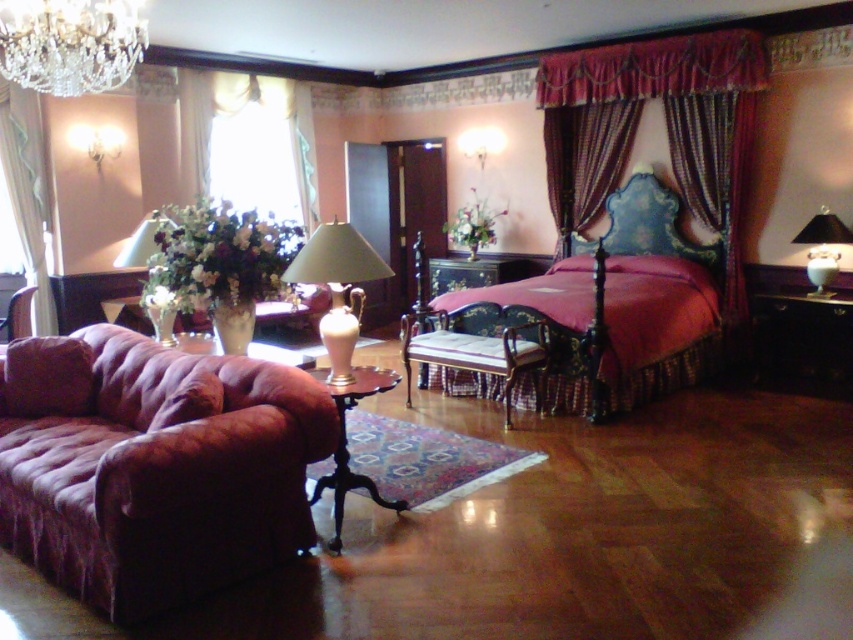
Question: Considering the relative positions of green glass lamp at center and wooden table at center in the image provided, where is green glass lamp at center located with respect to wooden table at center?

Choices:
 (A) above
 (B) below

Answer: (A)

Question: Which is nearer to the green glass lamp at center?

Choices:
 (A) velvet purple couch at lower left
 (B) white sheer curtain at upper left

Answer: (A)

Question: Can you confirm if velvet purple couch at lower left is bigger than velvet burgundy bed at center?

Choices:
 (A) no
 (B) yes

Answer: (A)

Question: Which object appears closest to the camera in this image?

Choices:
 (A) velvet burgundy bed at center
 (B) wooden table at center

Answer: (B)

Question: Is velvet red curtains at upper right behind white sheer curtain at upper left?

Choices:
 (A) no
 (B) yes

Answer: (A)

Question: Which point appears farthest from the camera in this image?

Choices:
 (A) click(x=24, y=317)
 (B) click(x=590, y=216)

Answer: (B)